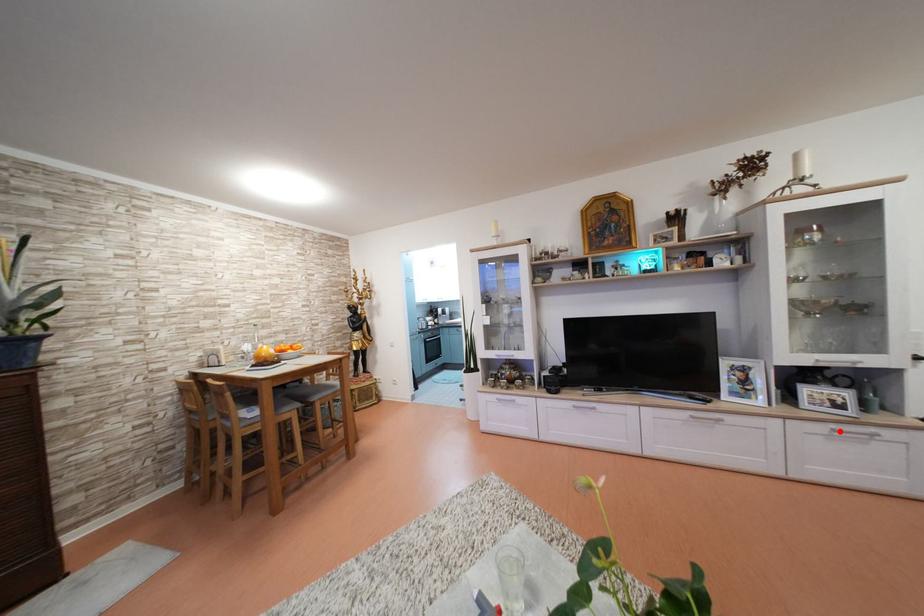
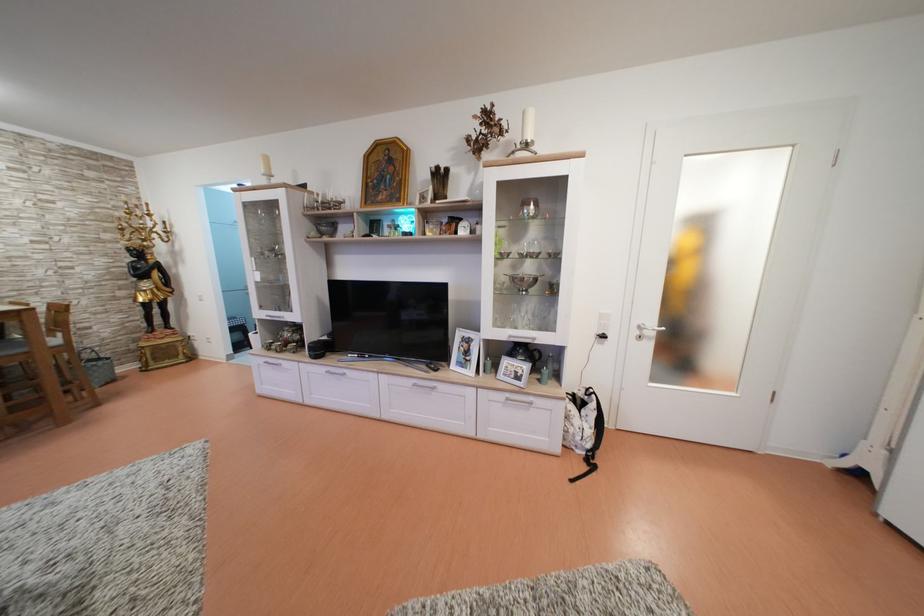
Question: I am providing you with two images of the same scene from different viewpoints. A red point is shown in image1. For the corresponding object point in image2, is it positioned nearer or farther from the camera?

Choices:
 (A) Nearer
 (B) Farther

Answer: (B)